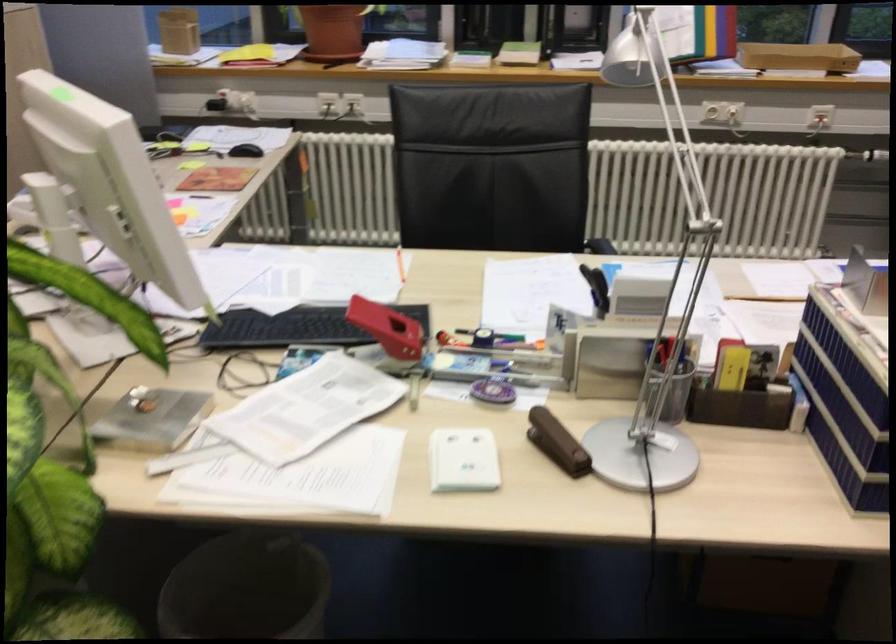
Image resolution: width=896 pixels, height=644 pixels. What do you see at coordinates (332, 31) in the screenshot?
I see `the terracotta flower pot` at bounding box center [332, 31].